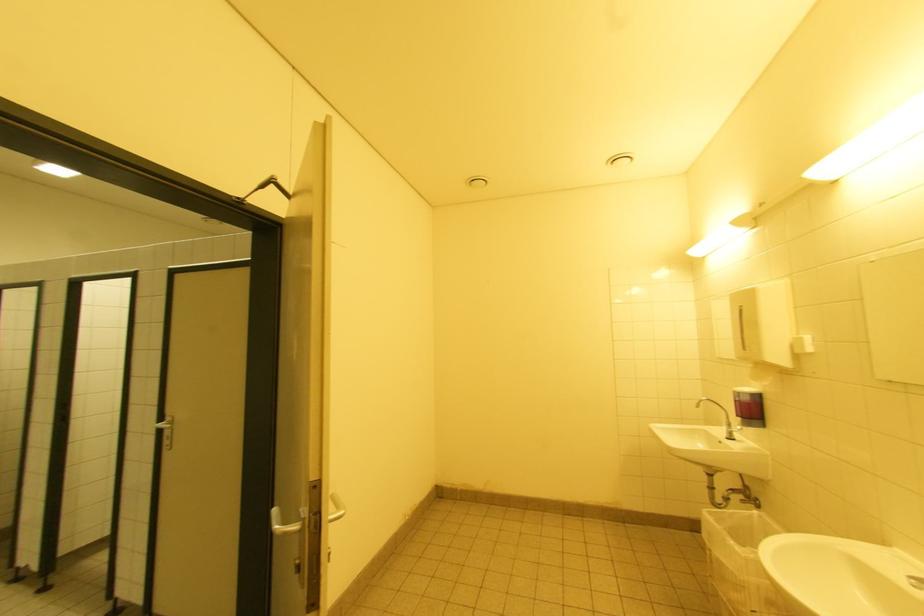
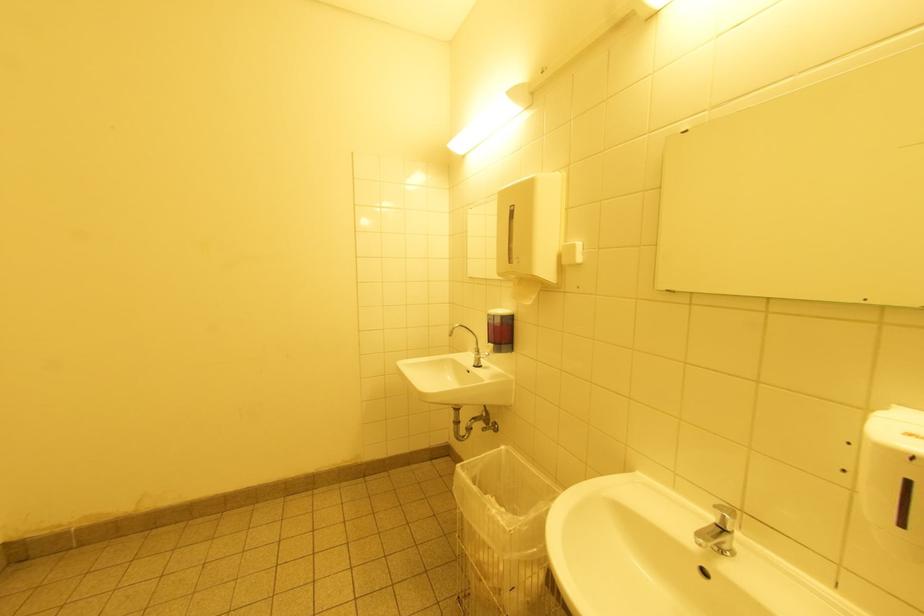
Question: The camera is either moving clockwise (left) or counter-clockwise (right) around the object. The first image is from the beginning of the video and the second image is from the end. Is the camera moving left or right when shooting the video?

Choices:
 (A) Left
 (B) Right

Answer: (A)